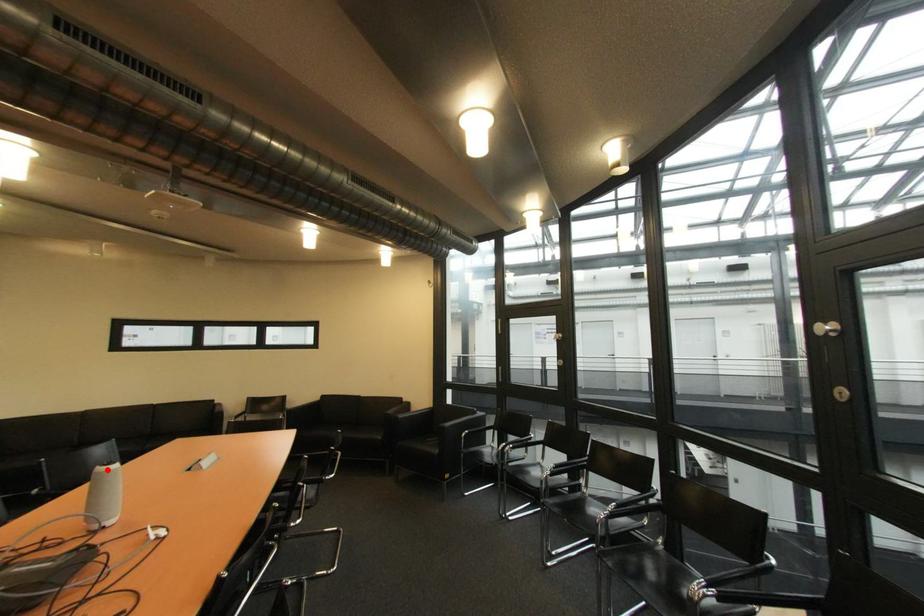
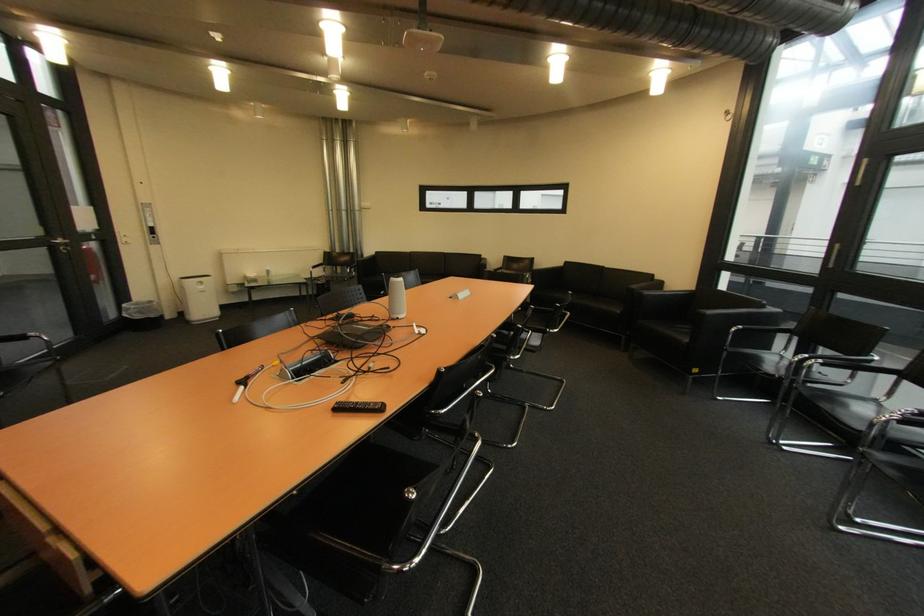
Question: I am providing you with two images of the same scene from different viewpoints. In image1, a red point is highlighted. Considering the same 3D point in image2, which of the following is correct?

Choices:
 (A) It is closer
 (B) It is farther

Answer: (B)